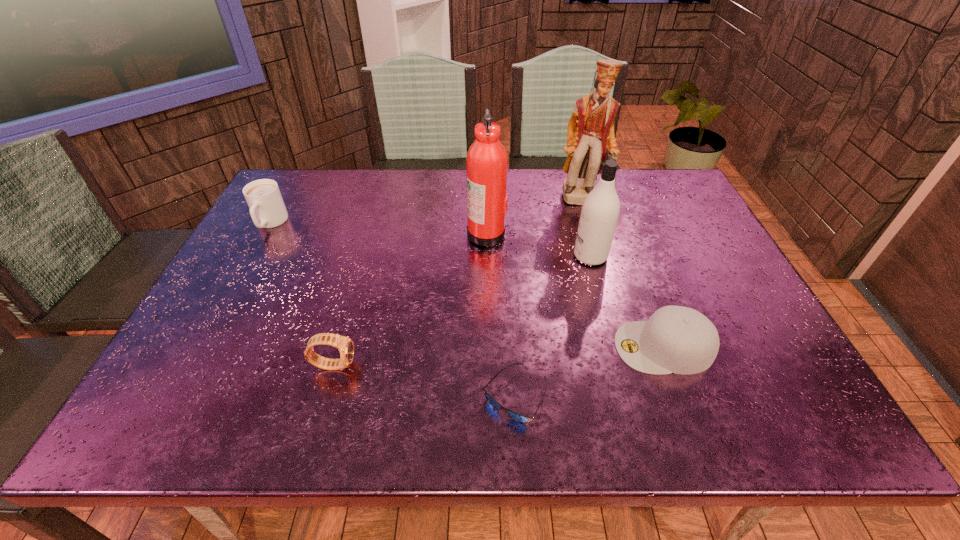
Identify the location of free space at the near left corner. The height and width of the screenshot is (540, 960). (151, 426).

This screenshot has width=960, height=540. In order to click on vacant space at the far right corner of the desktop in this screenshot , I will do `click(692, 208)`.

Where is `unoccupied position between the fire extinguisher and the fifth shortest object`? This screenshot has width=960, height=540. unoccupied position between the fire extinguisher and the fifth shortest object is located at coordinates (539, 245).

Where is `vacant area that lies between the third tallest object and the shortest object`? vacant area that lies between the third tallest object and the shortest object is located at coordinates (552, 326).

Where is `unoccupied position between the nutcracker and the fourth shortest object`? This screenshot has width=960, height=540. unoccupied position between the nutcracker and the fourth shortest object is located at coordinates (428, 211).

Where is `vacant area that lies between the fire extinguisher and the cap`? Image resolution: width=960 pixels, height=540 pixels. vacant area that lies between the fire extinguisher and the cap is located at coordinates (575, 290).

The height and width of the screenshot is (540, 960). What are the coordinates of `free space between the fifth shortest object and the watch` in the screenshot? It's located at (462, 310).

Image resolution: width=960 pixels, height=540 pixels. Find the location of `unoccupied area between the leftmost object and the shampoo`. unoccupied area between the leftmost object and the shampoo is located at coordinates (430, 240).

At what (x,y) coordinates should I click in order to perform the action: click on free area in between the nutcracker and the sixth object from right to left. Please return your answer as a coordinate pair (x, y). The height and width of the screenshot is (540, 960). Looking at the image, I should click on (460, 282).

Image resolution: width=960 pixels, height=540 pixels. I want to click on empty space between the cap and the sunglasses, so click(x=589, y=372).